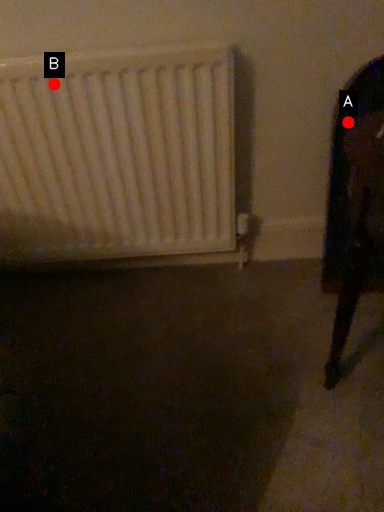
Question: Two points are circled on the image, labeled by A and B beside each circle. Among these points, which one is nearest to the camera?

Choices:
 (A) A is closer
 (B) B is closer

Answer: (A)